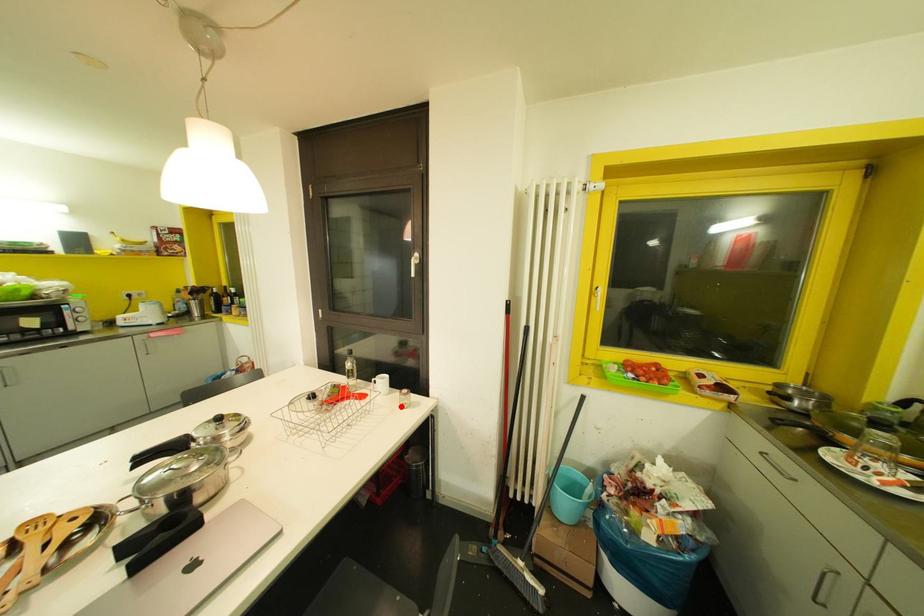
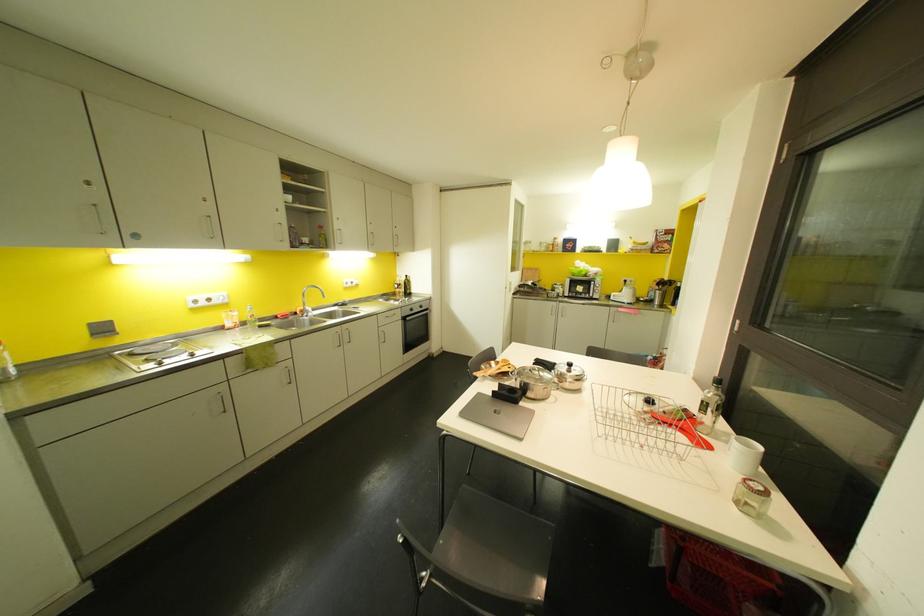
Question: I am providing you with two images of the same scene from different viewpoints. A red point is shown in image1. For the corresponding object point in image2, is it positioned nearer or farther from the camera?

Choices:
 (A) Nearer
 (B) Farther

Answer: (A)